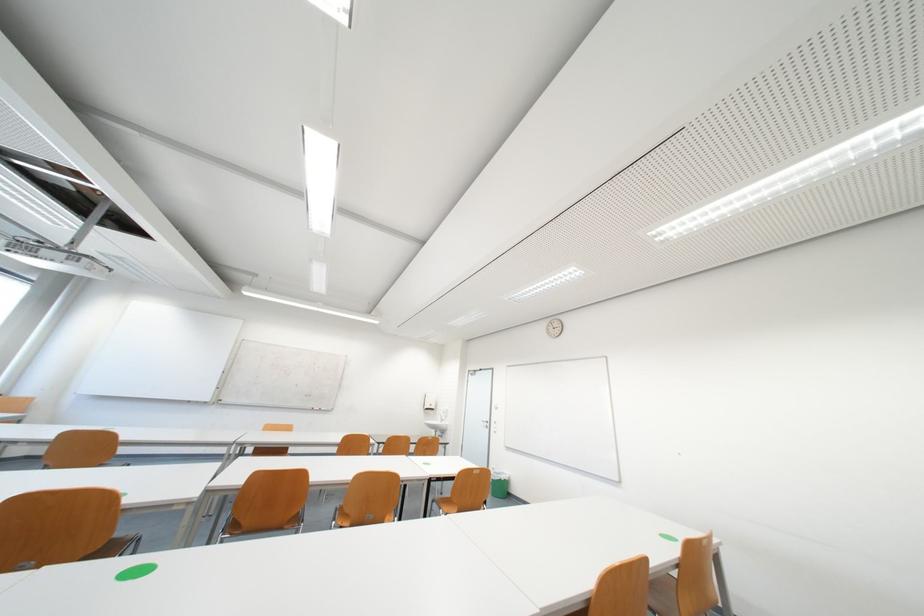
Find where to push the dispenser lever. Please return your answer as a coordinate pair (x, y).

(435, 419)